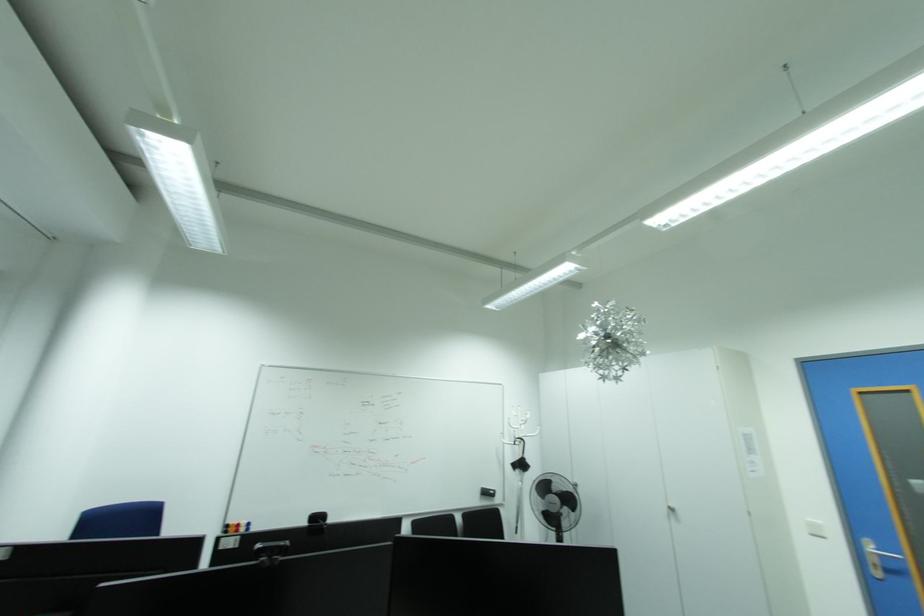
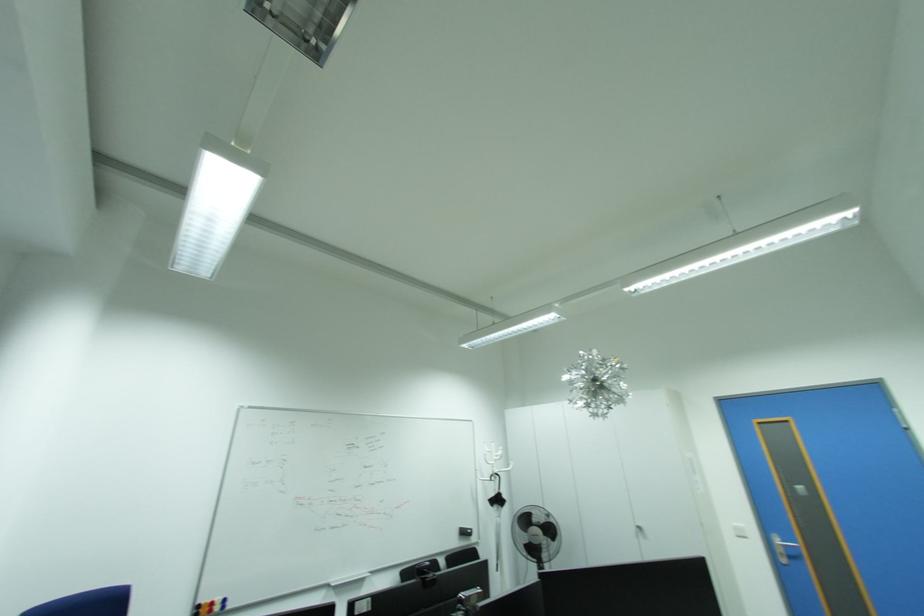
Question: The camera is either moving clockwise (left) or counter-clockwise (right) around the object. The first image is from the beginning of the video and the second image is from the end. Is the camera moving left or right when shooting the video?

Choices:
 (A) Left
 (B) Right

Answer: (A)